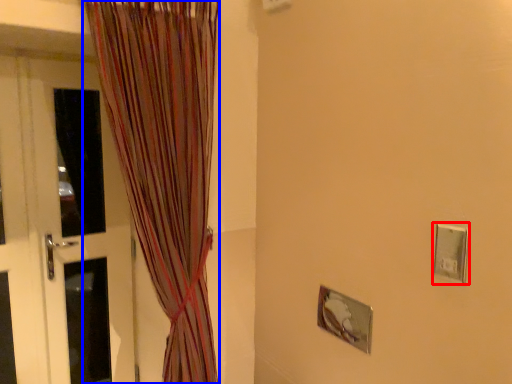
Question: Which point is closer to the camera, electric outlet (highlighted by a red box) or curtain (highlighted by a blue box)?

Choices:
 (A) electric outlet
 (B) curtain

Answer: (A)